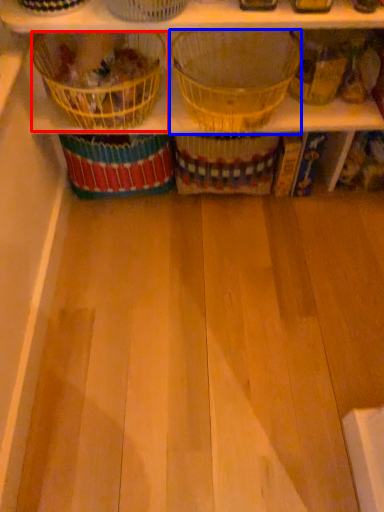
Question: Among these objects, which one is farthest to the camera, basket (highlighted by a red box) or basket (highlighted by a blue box)?

Choices:
 (A) basket
 (B) basket

Answer: (A)